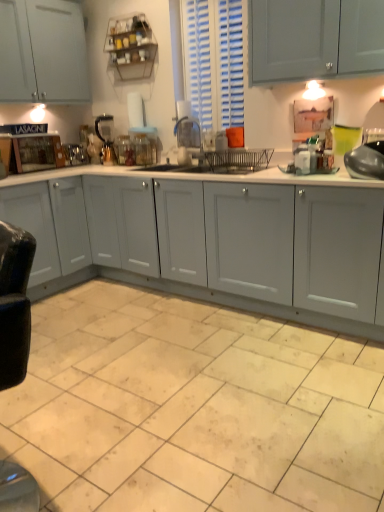
Question: From the image's perspective, is wooden cutting board at left above or below beige ceramic tile at lower center?

Choices:
 (A) above
 (B) below

Answer: (A)

Question: Considering the positions of wooden cutting board at left and beige ceramic tile at lower center in the image, is wooden cutting board at left taller or shorter than beige ceramic tile at lower center?

Choices:
 (A) short
 (B) tall

Answer: (B)

Question: Estimate the real-world distances between objects in this image. Which object is closer to the metallic silver coffee maker at center, which is the 5th appliance in right-to-left order?

Choices:
 (A) wooden cutting board at left
 (B) shiny metallic pot at right, marked as the 1th appliance in a right-to-left arrangement
 (C) clear glass jar at center, the third appliance when ordered from front to back
 (D) teal glass at upper right
 (E) beige ceramic tile at lower center

Answer: (A)

Question: Which object is the closest to the metallic silver coffee maker at center, which is the 5th appliance in right-to-left order?

Choices:
 (A) metallic silver faucet at center, which ranks as the second appliance in front-to-back order
 (B) clear glass jar at center, which appears as the third appliance when viewed from the left
 (C) wooden cutting board at left
 (D) teal glass at upper right
 (E) shiny metallic pot at right, the fifth appliance in the back-to-front sequence

Answer: (C)